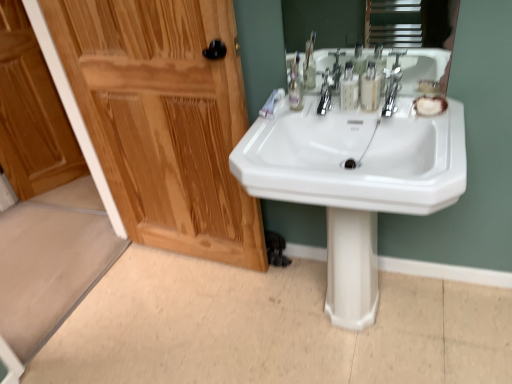
Find the location of a particular element. The image size is (512, 384). blank space to the left of shiny wood door at left is located at coordinates (128, 291).